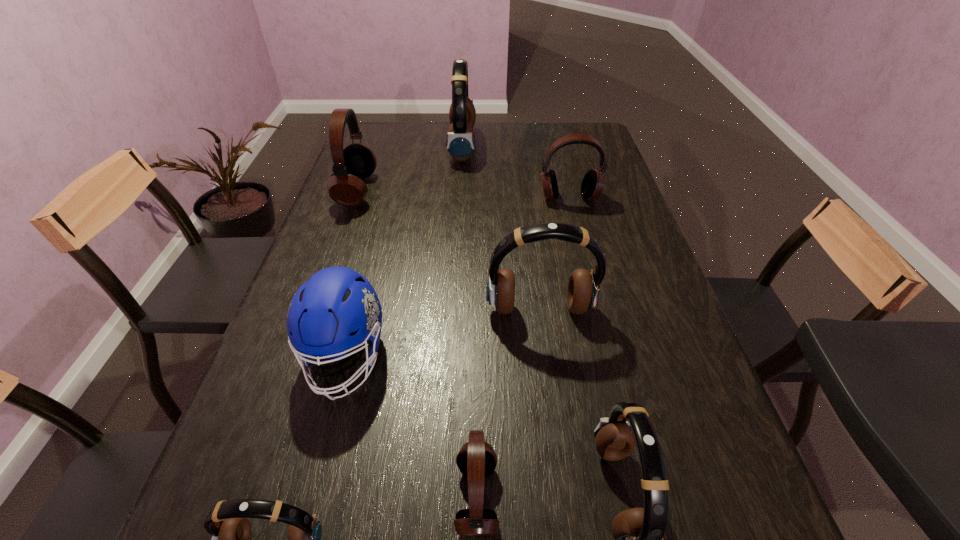
Where is `blank space located 0.050m on the face guard of the football helmet`? blank space located 0.050m on the face guard of the football helmet is located at coordinates coord(325,434).

This screenshot has width=960, height=540. I want to click on free space located on the ear pads of the second smallest black headset, so click(x=580, y=242).

Where is `object that is at the far edge`? Image resolution: width=960 pixels, height=540 pixels. object that is at the far edge is located at coordinates click(x=460, y=140).

The image size is (960, 540). Find the location of `headset at the left edge`. headset at the left edge is located at coordinates (355, 162).

Find the location of `football helmet that is at the left edge`. football helmet that is at the left edge is located at coordinates coord(336,301).

This screenshot has height=540, width=960. I want to click on object at the right edge, so click(x=592, y=185).

Find the location of `vacant space at the far edge of the desktop`. vacant space at the far edge of the desktop is located at coordinates click(x=533, y=123).

Where is `free space at the left edge of the desktop`? The height and width of the screenshot is (540, 960). free space at the left edge of the desktop is located at coordinates (366, 237).

In the image, there is a desktop. At what (x,y) coordinates should I click in order to perform the action: click on free space at the right edge. Please return your answer as a coordinate pair (x, y). Looking at the image, I should click on (627, 305).

Locate an element on the screen. This screenshot has height=540, width=960. free space at the far right corner is located at coordinates (591, 131).